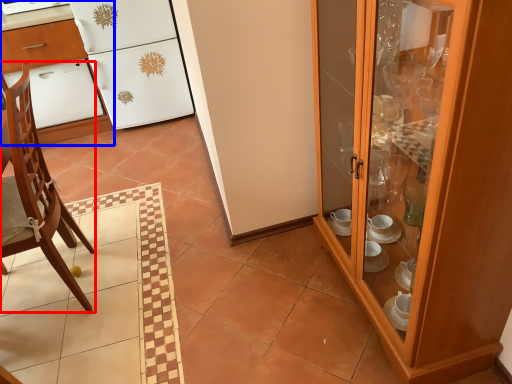
Question: Which point is closer to the camera, chair (highlighted by a red box) or desk (highlighted by a blue box)?

Choices:
 (A) chair
 (B) desk

Answer: (A)